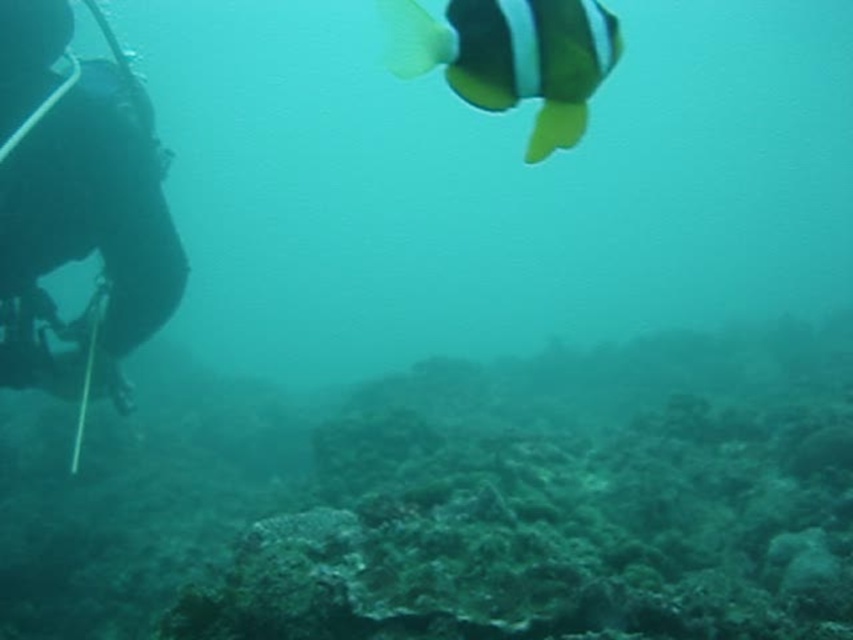
Based on the photo, you are a marine biologist studying underwater ecosystems. You need to collect samples from both the vibrant fish in the upper right and the green mossy coral reef at center. Given that your sampling equipment has a maximum reach of 2 meters, can you collect both samples without moving your position?

The vibrant fish in the upper right and the green mossy coral reef at center are 1.94 meters apart. Since your equipment can reach up to 2 meters, you can collect both samples without moving your position.

You are a marine biologist studying underwater equipment placement. You notice a point at coordinates (93, 216) in the image. What object is located at that point?

The black rubber wetsuit at left is located at point (93, 216).

You are a marine biologist studying underwater ecosystems. You observe the point at coordinates (450, 499) in the image. What is located at that point?

The point at coordinates (450, 499) is occupied by the green mossy coral reef at center.